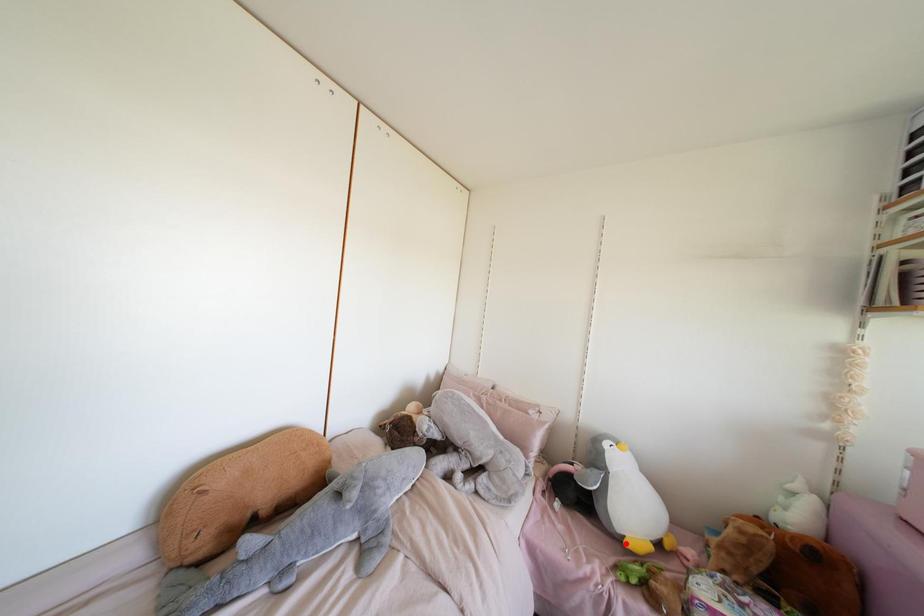
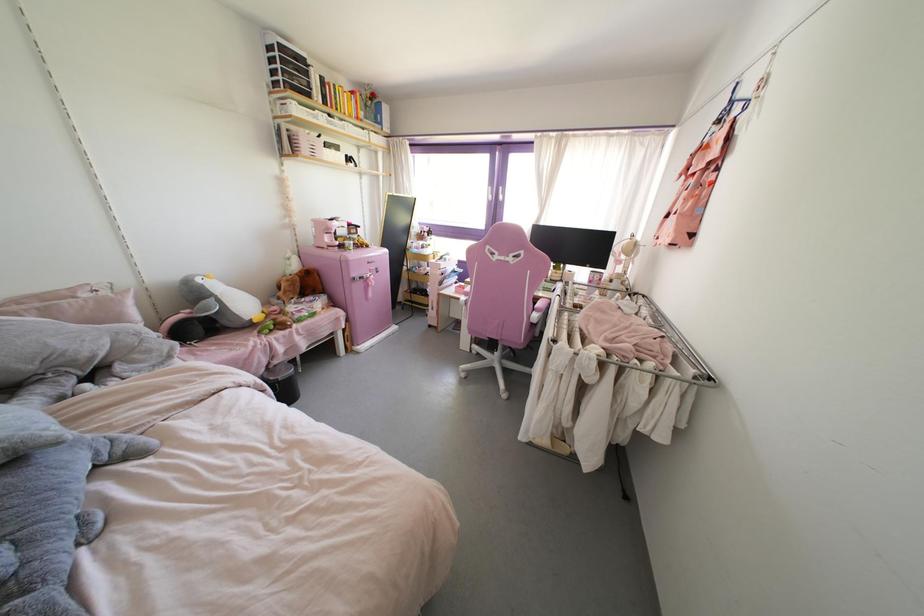
Where in the second image is the point corresponding to the highlighted location from the first image?

(254, 320)